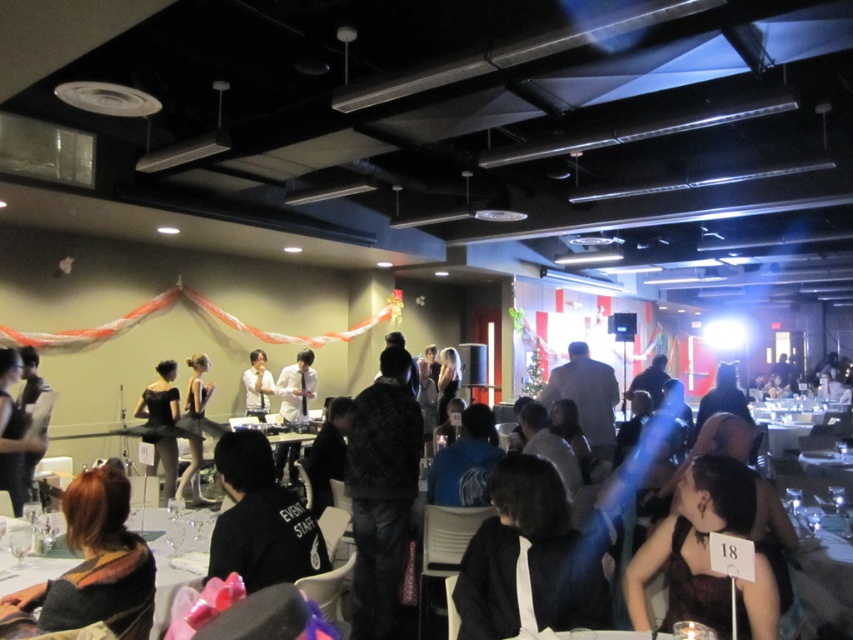
Question: Which point is closer to the camera taking this photo?

Choices:
 (A) (376, 598)
 (B) (247, 371)

Answer: (A)

Question: Considering the real-world distances, which object is farthest from the black fabric shirt at center?

Choices:
 (A) white glossy shirt at center
 (B) plaid shirt at center
 (C) black satin dress at left

Answer: (A)

Question: Is black matte dress at center wider than translucent glass table at lower left?

Choices:
 (A) no
 (B) yes

Answer: (B)

Question: Is black fabric shirt at center positioned at the back of metallic silver table at lower right?

Choices:
 (A) no
 (B) yes

Answer: (A)

Question: Can you confirm if black dress at center is positioned above matte black dress at center?

Choices:
 (A) yes
 (B) no

Answer: (A)

Question: Which object is closer to the camera taking this photo?

Choices:
 (A) matte black dress at center
 (B) black satin dress at lower right
 (C) black dress at center
 (D) translucent glass table at lower left

Answer: (B)